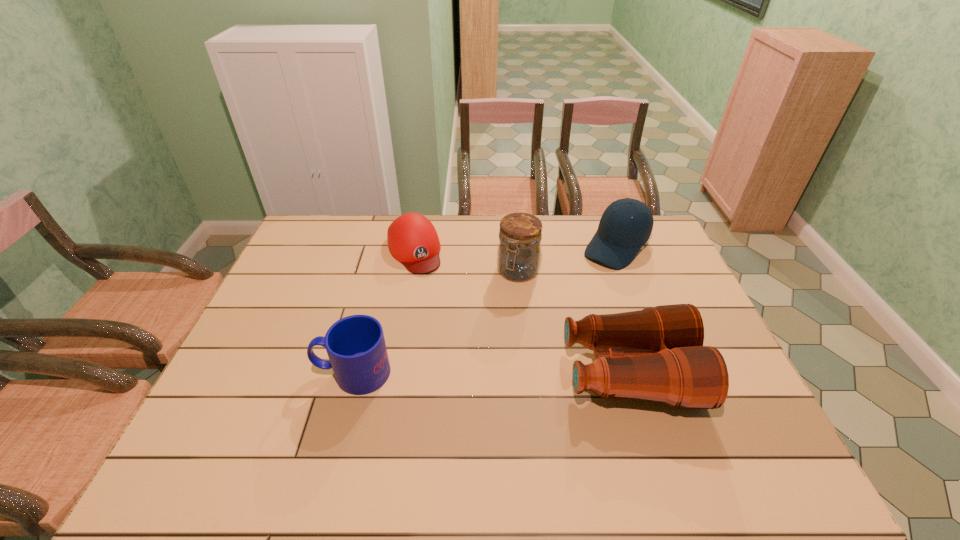
The height and width of the screenshot is (540, 960). I want to click on vacant region located 0.060m through the lenses of the binoculars, so click(x=714, y=373).

Locate an element on the screen. The height and width of the screenshot is (540, 960). vacant space located on the front-facing side of the shortest object is located at coordinates (460, 354).

At what (x,y) coordinates should I click in order to perform the action: click on free location located 0.210m on the front-facing side of the shortest object. Please return your answer as a coordinate pair (x, y). Looking at the image, I should click on (441, 315).

You are a GUI agent. You are given a task and a screenshot of the screen. Output one action in this format:
    pyautogui.click(x=<x>, y=<y>)
    Task: Click on the vacant space located 0.330m on the front-facing side of the shortest object
    Image resolution: width=960 pixels, height=540 pixels.
    Given the screenshot: What is the action you would take?
    pyautogui.click(x=455, y=344)

Locate an element on the screen. This screenshot has height=540, width=960. free space located on the front-facing side of the right baseball cap is located at coordinates (569, 301).

Find the location of a particular element. Image resolution: width=960 pixels, height=540 pixels. vacant region located on the front-facing side of the right baseball cap is located at coordinates (589, 278).

Where is `free space located on the front-facing side of the right baseball cap`? This screenshot has height=540, width=960. free space located on the front-facing side of the right baseball cap is located at coordinates (574, 296).

Image resolution: width=960 pixels, height=540 pixels. Find the location of `free space located on the lid of the tallest object`. free space located on the lid of the tallest object is located at coordinates (486, 328).

This screenshot has width=960, height=540. Identify the location of vacant space located on the lid of the tallest object. (471, 353).

Find the location of a particular element. free point located 0.220m on the lid of the tallest object is located at coordinates (483, 333).